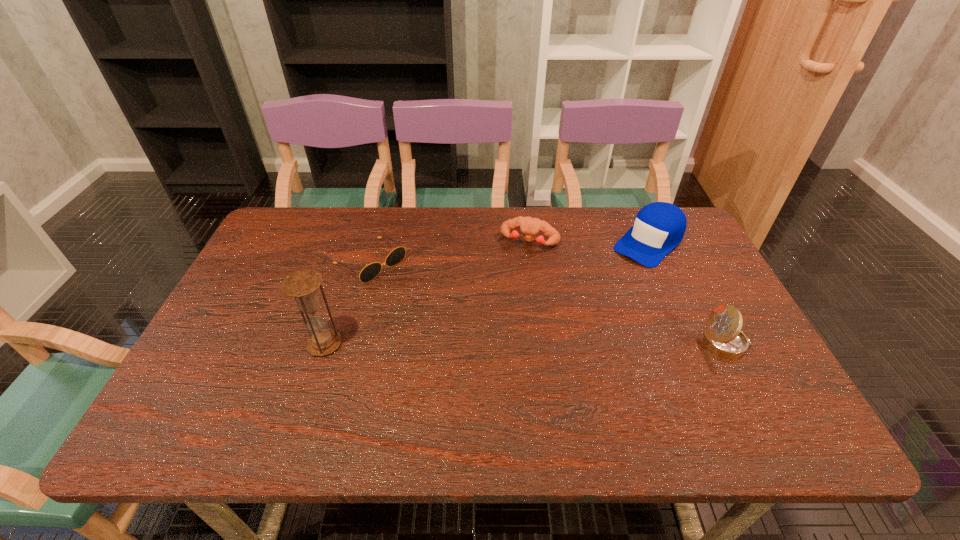
Identify the location of empty location between the second shortest object and the baseball cap. (589, 242).

This screenshot has height=540, width=960. Identify the location of free space between the hourglass and the compass. (525, 344).

You are a GUI agent. You are given a task and a screenshot of the screen. Output one action in this format:
    pyautogui.click(x=<x>, y=<y>)
    Task: Click on the empty space between the tallest object and the puncher
    The image size is (960, 540).
    Given the screenshot: What is the action you would take?
    pyautogui.click(x=427, y=293)

At what (x,y) coordinates should I click in order to perform the action: click on free spot between the puncher and the compass. Please return your answer as a coordinate pair (x, y). The image size is (960, 540). Looking at the image, I should click on (628, 293).

Find the location of `blank region between the tallest object and the sunglasses`. blank region between the tallest object and the sunglasses is located at coordinates (348, 303).

Where is `vacant region between the baseball cap and the sunglasses`? This screenshot has width=960, height=540. vacant region between the baseball cap and the sunglasses is located at coordinates (510, 252).

At what (x,y) coordinates should I click in order to perform the action: click on free spot between the sunglasses and the baseball cap. Please return your answer as a coordinate pair (x, y). Looking at the image, I should click on (510, 252).

I want to click on object that is the fourth closest one to the baseball cap, so click(302, 285).

Choose which object is the third nearest neighbor to the compass. Please provide its 2D coordinates. Your answer should be formatted as a tuple, i.e. [(x, y)], where the tuple contains the x and y coordinates of a point satisfying the conditions above.

[(368, 273)]

Locate an element on the screen. free point that satisfies the following two spatial constraints: 1. on the front side of the baseball cap; 2. on the left side of the fourth tallest object is located at coordinates [x=530, y=242].